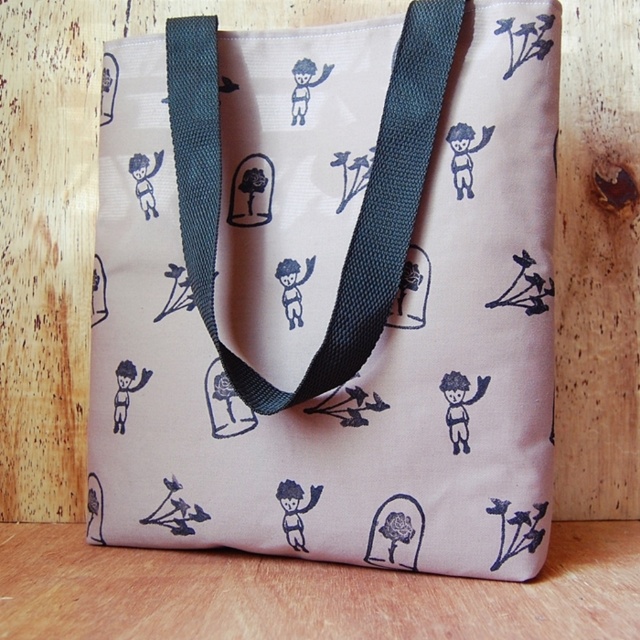
Question: Which object is farther from the camera taking this photo?

Choices:
 (A) black fabric strap at center
 (B) pink fabric tote at center

Answer: (B)

Question: Can you confirm if pink fabric tote at center is thinner than black fabric strap at center?

Choices:
 (A) no
 (B) yes

Answer: (A)

Question: Can you confirm if pink fabric tote at center is bigger than black fabric strap at center?

Choices:
 (A) yes
 (B) no

Answer: (A)

Question: Does pink fabric tote at center have a greater width compared to black fabric strap at center?

Choices:
 (A) no
 (B) yes

Answer: (B)

Question: Among these objects, which one is nearest to the camera?

Choices:
 (A) black fabric strap at center
 (B) pink fabric tote at center

Answer: (A)

Question: Which object is farther from the camera taking this photo?

Choices:
 (A) black fabric strap at center
 (B) pink fabric tote at center

Answer: (B)